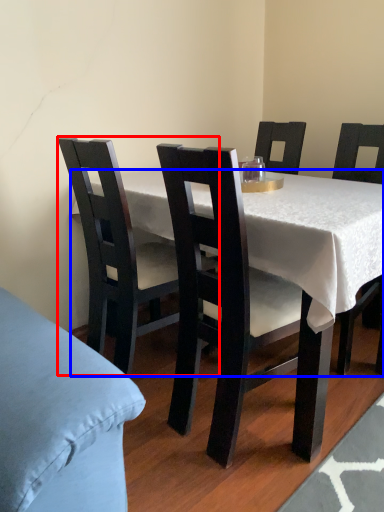
Question: Which of the following is the closest to the observer, chair (highlighted by a red box) or desk (highlighted by a blue box)?

Choices:
 (A) chair
 (B) desk

Answer: (B)